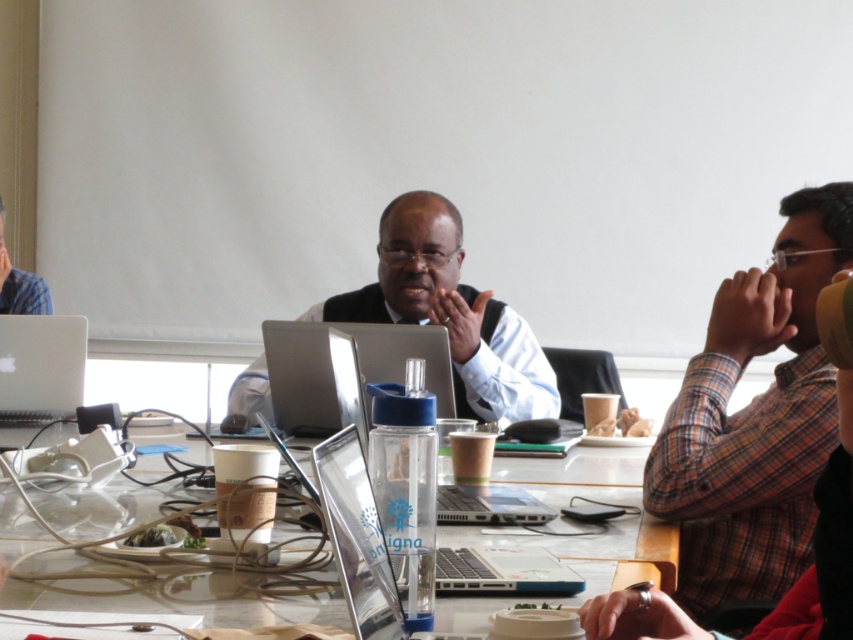
Question: Considering the real-world distances, which object is farthest from the white glossy laptop at left?

Choices:
 (A) plaid shirt at right
 (B) matte black vest at center

Answer: (A)

Question: Which point is farther to the camera?

Choices:
 (A) white glossy laptop at left
 (B) clear plastic laptop at center
 (C) clear plastic water bottle at center

Answer: (A)

Question: Is plaid shirt at right to the right of white glossy laptop at left from the viewer's perspective?

Choices:
 (A) yes
 (B) no

Answer: (A)

Question: Is plaid shirt at right to the left of clear plastic water bottle at center from the viewer's perspective?

Choices:
 (A) yes
 (B) no

Answer: (B)

Question: Which of the following is the farthest from the observer?

Choices:
 (A) clear plastic laptop at center
 (B) clear plastic water bottle at center

Answer: (A)

Question: Is plaid shirt at right thinner than clear plastic water bottle at center?

Choices:
 (A) yes
 (B) no

Answer: (A)